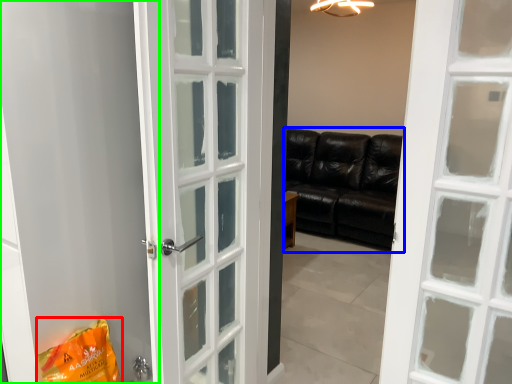
Question: Which is nearer to the shopping bag (highlighted by a red box)? studio couch (highlighted by a blue box) or screen door (highlighted by a green box).

Choices:
 (A) studio couch
 (B) screen door

Answer: (B)